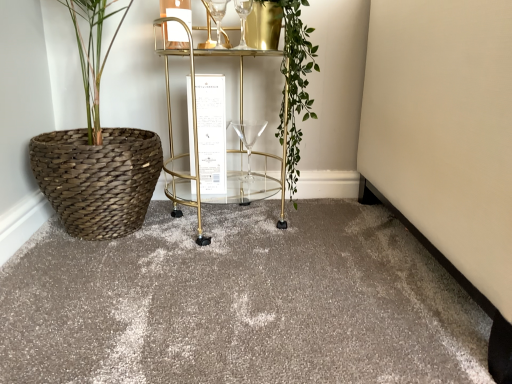
At what (x,y) coordinates should I click in order to perform the action: click on vacant area that is in front of gold metallic bar cart at center. Please return your answer as a coordinate pair (x, y). This screenshot has width=512, height=384. Looking at the image, I should click on (213, 268).